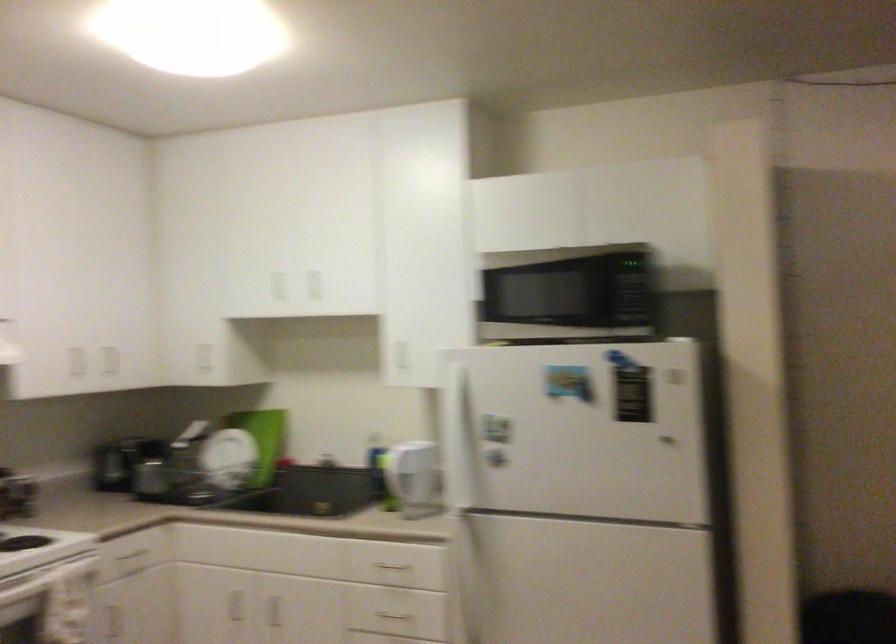
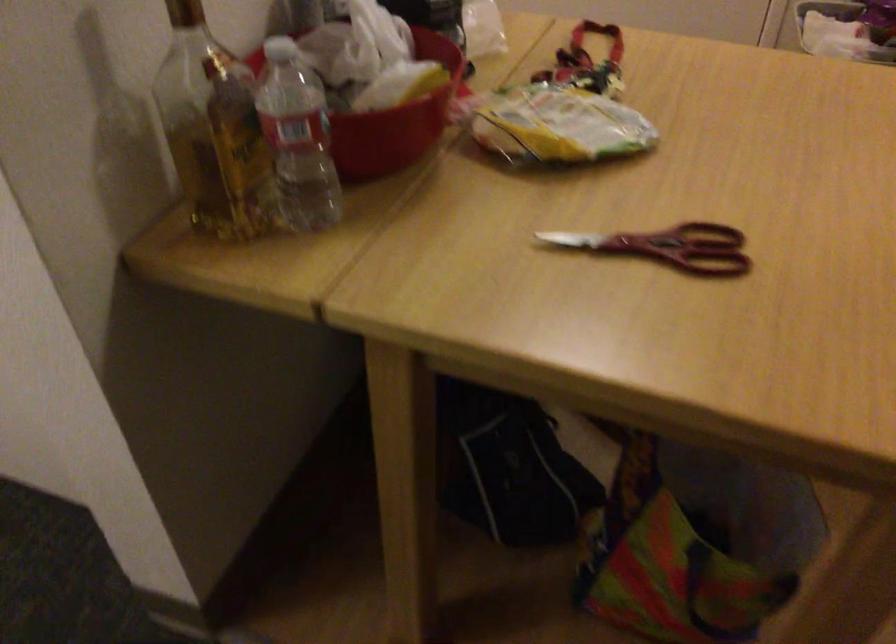
The first image is from the beginning of the video and the second image is from the end. How did the camera likely rotate when shooting the video?

The rotation direction of the camera is left-down.